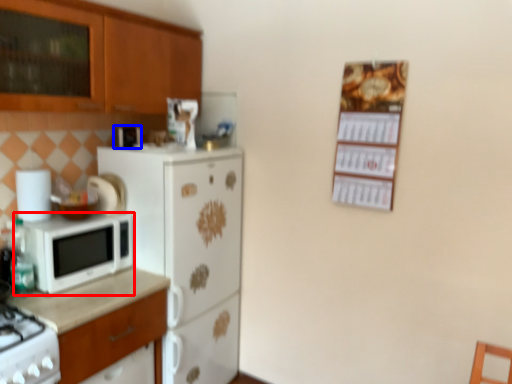
Question: Which of the following is the closest to the observer, microwave oven (highlighted by a red box) or appliance (highlighted by a blue box)?

Choices:
 (A) microwave oven
 (B) appliance

Answer: (A)